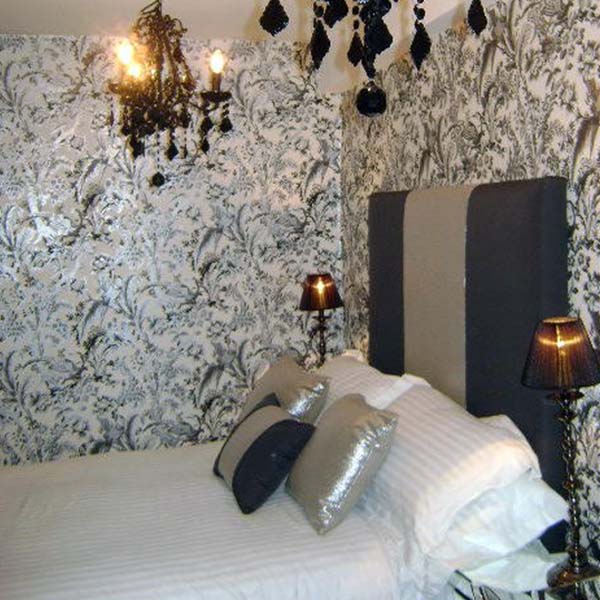
Identify the location of pillow. (305, 395).